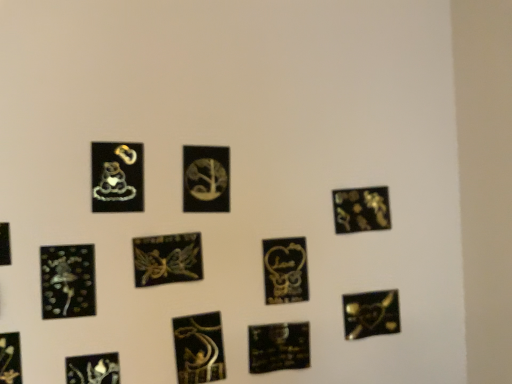
Locate an element on the screen. black glossy picture frame at lower center, which is the 9th picture frame in left-to-right order is located at coordinates (278, 347).

What do you see at coordinates (278, 347) in the screenshot? I see `black glossy picture frame at lower center, the 4th picture frame positioned from the right` at bounding box center [278, 347].

What is the approximate width of matte black heart at lower left, which is the 9th picture frame from right to left?

It is 0.68 inches.

What do you see at coordinates (117, 177) in the screenshot?
I see `matte gold charm at upper left, placed as the 5th picture frame when sorted from left to right` at bounding box center [117, 177].

The height and width of the screenshot is (384, 512). What do you see at coordinates (371, 314) in the screenshot?
I see `gold metallic heart at lower right, arranged as the first picture frame when viewed from the right` at bounding box center [371, 314].

What do you see at coordinates (5, 244) in the screenshot? I see `black glossy picture frame at lower left, which is counted as the 12th picture frame, starting from the right` at bounding box center [5, 244].

You are a GUI agent. You are given a task and a screenshot of the screen. Output one action in this format:
    pyautogui.click(x=<x>, y=<y>)
    Task: Click on the matte black sticker at center, positioned as the 6th picture frame in right-to-left order
    The width and height of the screenshot is (512, 384).
    Given the screenshot: What is the action you would take?
    pyautogui.click(x=199, y=348)

Locate an element on the screen. black glossy picture frame at lower center, the 4th picture frame positioned from the right is located at coordinates pyautogui.click(x=278, y=347).

Considering the sizes of matte gold clock at center, the fifth picture frame in the right-to-left sequence, and metallic gold fairy at center, marked as the sixth picture frame in a left-to-right arrangement, in the image, is matte gold clock at center, the fifth picture frame in the right-to-left sequence, taller or shorter than metallic gold fairy at center, marked as the sixth picture frame in a left-to-right arrangement,?

matte gold clock at center, the fifth picture frame in the right-to-left sequence, is taller than metallic gold fairy at center, marked as the sixth picture frame in a left-to-right arrangement.

From the image's perspective, is matte gold clock at center, which is the eighth picture frame in left-to-right order, above metallic gold fairy at center, marked as the sixth picture frame in a left-to-right arrangement?

Correct, matte gold clock at center, which is the eighth picture frame in left-to-right order, appears higher than metallic gold fairy at center, marked as the sixth picture frame in a left-to-right arrangement, in the image.

Is matte gold clock at center, the fifth picture frame in the right-to-left sequence, spatially inside metallic gold fairy at center, marked as the sixth picture frame in a left-to-right arrangement, or outside of it?

matte gold clock at center, the fifth picture frame in the right-to-left sequence, is not enclosed by metallic gold fairy at center, marked as the sixth picture frame in a left-to-right arrangement.

Measure the distance between matte gold clock at center, the fifth picture frame in the right-to-left sequence, and metallic gold fairy at center, the seventh picture frame when ordered from right to left.

matte gold clock at center, the fifth picture frame in the right-to-left sequence, is 6.88 inches away from metallic gold fairy at center, the seventh picture frame when ordered from right to left.

Relative to gold metallic heart at lower right, the twelfth picture frame viewed from the left, is matte black sticker at upper right, which is the second picture frame from right to left, in front or behind?

matte black sticker at upper right, which is the second picture frame from right to left, is positioned farther from the viewer than gold metallic heart at lower right, the twelfth picture frame viewed from the left.

Can you see matte black sticker at upper right, the eleventh picture frame positioned from the left, touching gold metallic heart at lower right, arranged as the first picture frame when viewed from the right?

Answer: matte black sticker at upper right, the eleventh picture frame positioned from the left, is not next to gold metallic heart at lower right, arranged as the first picture frame when viewed from the right, and they're not touching.

Which is correct: matte black sticker at upper right, which is the second picture frame from right to left, is inside gold metallic heart at lower right, arranged as the first picture frame when viewed from the right, or outside of it?

The correct answer is: outside.

Is the position of black glossy picture frame at lower left, arranged as the 1th picture frame when viewed from the left, less distant than that of metallic gold flower at bottom left, the eleventh picture frame in the right-to-left sequence?

Yes, the depth of black glossy picture frame at lower left, arranged as the 1th picture frame when viewed from the left, is less than that of metallic gold flower at bottom left, the eleventh picture frame in the right-to-left sequence.

From a real-world perspective, is black glossy picture frame at lower left, arranged as the 1th picture frame when viewed from the left, physically located above or below metallic gold flower at bottom left, positioned as the 2th picture frame in left-to-right order?

black glossy picture frame at lower left, arranged as the 1th picture frame when viewed from the left, is above metallic gold flower at bottom left, positioned as the 2th picture frame in left-to-right order.

Is point (1, 232) positioned before point (9, 343)?

That is False.

Based on the photo, who is taller, black glossy picture frame at lower left, arranged as the 1th picture frame when viewed from the left, or metallic gold flower at bottom left, the eleventh picture frame in the right-to-left sequence?

metallic gold flower at bottom left, the eleventh picture frame in the right-to-left sequence.

Considering the positions of points (141, 264) and (17, 356), is point (141, 264) farther from camera compared to point (17, 356)?

Yes, it is.

Are metallic gold fairy at center, marked as the sixth picture frame in a left-to-right arrangement, and metallic gold flower at bottom left, the eleventh picture frame in the right-to-left sequence, located far from each other?

No.

Between metallic gold fairy at center, the seventh picture frame when ordered from right to left, and metallic gold flower at bottom left, positioned as the 2th picture frame in left-to-right order, which one has larger size?

metallic gold fairy at center, the seventh picture frame when ordered from right to left.

Is metallic gold flower at bottom left, positioned as the 2th picture frame in left-to-right order, located within metallic gold fairy at center, marked as the sixth picture frame in a left-to-right arrangement?

No, metallic gold fairy at center, marked as the sixth picture frame in a left-to-right arrangement, does not contain metallic gold flower at bottom left, positioned as the 2th picture frame in left-to-right order.

How many degrees apart are the facing directions of black glossy picture frame at lower center, which is the 9th picture frame in left-to-right order, and glossy black clock at lower left, the third picture frame when ordered from left to right?

They differ by 1.44 degrees in their facing directions.

Which point is more forward, [295,363] or [48,287]?

The point [48,287] is more forward.

Is black glossy picture frame at lower center, which is the 9th picture frame in left-to-right order, inside the boundaries of glossy black clock at lower left, the third picture frame when ordered from left to right, or outside?

black glossy picture frame at lower center, which is the 9th picture frame in left-to-right order, is outside glossy black clock at lower left, the third picture frame when ordered from left to right.

Looking at this image, is there a large distance between black glossy picture frame at lower center, the 4th picture frame positioned from the right, and glossy black clock at lower left, the third picture frame when ordered from left to right?

They are positioned close to each other.

Considering the sizes of matte black sticker at upper right, the eleventh picture frame positioned from the left, and metallic gold flower at bottom left, positioned as the 2th picture frame in left-to-right order, in the image, is matte black sticker at upper right, the eleventh picture frame positioned from the left, bigger or smaller than metallic gold flower at bottom left, positioned as the 2th picture frame in left-to-right order,?

matte black sticker at upper right, the eleventh picture frame positioned from the left, is bigger than metallic gold flower at bottom left, positioned as the 2th picture frame in left-to-right order.

From a real-world perspective, is matte black sticker at upper right, the eleventh picture frame positioned from the left, over metallic gold flower at bottom left, the eleventh picture frame in the right-to-left sequence?

Yes.

Is metallic gold flower at bottom left, positioned as the 2th picture frame in left-to-right order, a part of matte black sticker at upper right, which is the second picture frame from right to left?

No, metallic gold flower at bottom left, positioned as the 2th picture frame in left-to-right order, is located outside of matte black sticker at upper right, which is the second picture frame from right to left.

Considering their positions, is matte black sticker at upper right, the eleventh picture frame positioned from the left, located in front of or behind metallic gold flower at bottom left, positioned as the 2th picture frame in left-to-right order?

In the image, matte black sticker at upper right, the eleventh picture frame positioned from the left, appears behind metallic gold flower at bottom left, positioned as the 2th picture frame in left-to-right order.

Does point (202, 149) appear closer or farther from the camera than point (127, 178)?

Clearly, point (202, 149) is more distant from the camera than point (127, 178).

Is matte gold clock at center, which is the eighth picture frame in left-to-right order, inside the boundaries of matte gold charm at upper left, placed as the 5th picture frame when sorted from left to right, or outside?

matte gold clock at center, which is the eighth picture frame in left-to-right order, is outside matte gold charm at upper left, placed as the 5th picture frame when sorted from left to right.

Which is behind, matte gold clock at center, which is the eighth picture frame in left-to-right order, or matte gold charm at upper left, which is counted as the 8th picture frame, starting from the right?

matte gold clock at center, which is the eighth picture frame in left-to-right order.

Considering the relative positions of matte gold clock at center, the fifth picture frame in the right-to-left sequence, and matte gold charm at upper left, which is counted as the 8th picture frame, starting from the right, in the image provided, is matte gold clock at center, the fifth picture frame in the right-to-left sequence, to the left of matte gold charm at upper left, which is counted as the 8th picture frame, starting from the right, from the viewer's perspective?

In fact, matte gold clock at center, the fifth picture frame in the right-to-left sequence, is to the right of matte gold charm at upper left, which is counted as the 8th picture frame, starting from the right.

Image resolution: width=512 pixels, height=384 pixels. I want to click on picture frame that is the 3rd one below the matte gold clock at center, the fifth picture frame in the right-to-left sequence (from a real-world perspective), so click(x=167, y=259).

Locate an element on the screen. The width and height of the screenshot is (512, 384). picture frame on the right of the matte black sticker at upper right, which is the second picture frame from right to left is located at coordinates (371, 314).

Looking at the image, which one is located closer to black glossy picture frame at lower left, arranged as the 1th picture frame when viewed from the left, matte gold charm at upper left, placed as the 5th picture frame when sorted from left to right, or black glossy picture frame at lower center, the 4th picture frame positioned from the right?

matte gold charm at upper left, placed as the 5th picture frame when sorted from left to right.

Based on their spatial positions, is matte gold clock at center, which is the eighth picture frame in left-to-right order, or metallic gold fairy at center, the seventh picture frame when ordered from right to left, further from matte black heart at lower left, which is the 9th picture frame from right to left?

matte gold clock at center, which is the eighth picture frame in left-to-right order, is further to matte black heart at lower left, which is the 9th picture frame from right to left.

Considering their positions, is metallic gold flower at bottom left, the eleventh picture frame in the right-to-left sequence, positioned closer to matte black sticker at center, placed as the seventh picture frame when sorted from left to right, than matte gold heart at center, which ranks as the third picture frame in right-to-left order?

Based on the image, matte gold heart at center, which ranks as the third picture frame in right-to-left order, appears to be nearer to matte black sticker at center, placed as the seventh picture frame when sorted from left to right.

Looking at the image, which one is located further to matte gold heart at center, acting as the tenth picture frame starting from the left, glossy black clock at lower left, the 10th picture frame positioned from the right, or metallic gold flower at bottom left, positioned as the 2th picture frame in left-to-right order?

metallic gold flower at bottom left, positioned as the 2th picture frame in left-to-right order, is further to matte gold heart at center, acting as the tenth picture frame starting from the left.

When comparing their distances from matte gold heart at center, which ranks as the third picture frame in right-to-left order, does matte black heart at lower left, which is the 4th picture frame from left to right, or matte black sticker at center, positioned as the 6th picture frame in right-to-left order, seem further?

matte black heart at lower left, which is the 4th picture frame from left to right.

Based on their spatial positions, is gold metallic heart at lower right, the twelfth picture frame viewed from the left, or glossy black clock at lower left, the third picture frame when ordered from left to right, further from matte black heart at lower left, which is the 4th picture frame from left to right?

gold metallic heart at lower right, the twelfth picture frame viewed from the left.

Estimate the real-world distances between objects in this image. Which object is further from matte gold heart at center, which ranks as the third picture frame in right-to-left order, metallic gold fairy at center, the seventh picture frame when ordered from right to left, or glossy black clock at lower left, the 10th picture frame positioned from the right?

The object further to matte gold heart at center, which ranks as the third picture frame in right-to-left order, is glossy black clock at lower left, the 10th picture frame positioned from the right.

Looking at the image, which one is located closer to glossy black clock at lower left, the 10th picture frame positioned from the right, gold metallic heart at lower right, arranged as the first picture frame when viewed from the right, or matte gold clock at center, which is the eighth picture frame in left-to-right order?

The object closer to glossy black clock at lower left, the 10th picture frame positioned from the right, is matte gold clock at center, which is the eighth picture frame in left-to-right order.